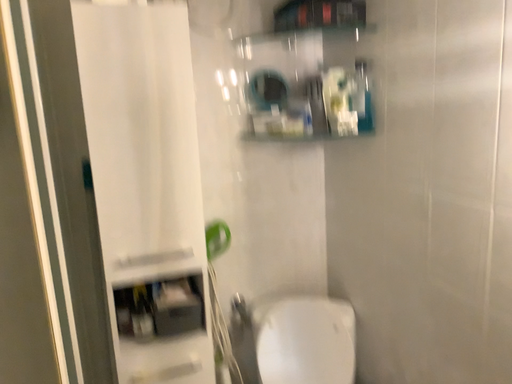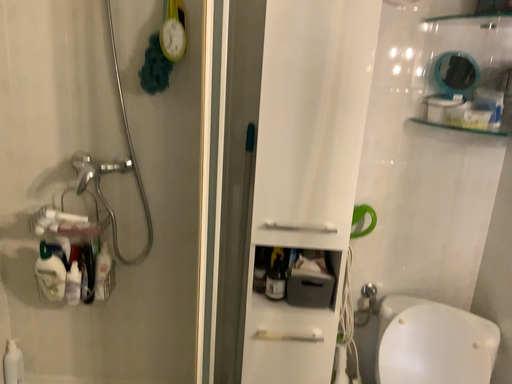
Question: How did the camera likely rotate when shooting the video?

Choices:
 (A) rotated right
 (B) rotated left

Answer: (B)